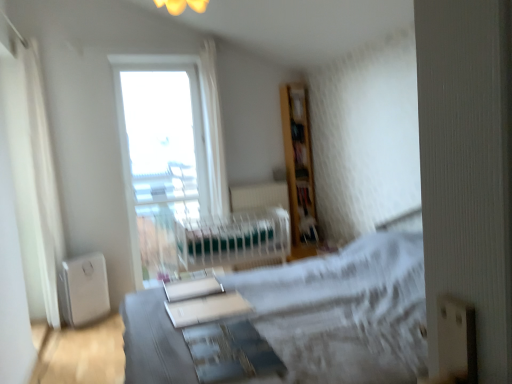
Question: Can you confirm if transparent glass window at upper center is smaller than green fabric hospital bed at center?

Choices:
 (A) no
 (B) yes

Answer: (A)

Question: Considering the relative sizes of transparent glass window at upper center and green fabric hospital bed at center in the image provided, is transparent glass window at upper center thinner than green fabric hospital bed at center?

Choices:
 (A) yes
 (B) no

Answer: (A)

Question: Is transparent glass window at upper center looking in the opposite direction of green fabric hospital bed at center?

Choices:
 (A) no
 (B) yes

Answer: (A)

Question: Is transparent glass window at upper center at the right side of green fabric hospital bed at center?

Choices:
 (A) no
 (B) yes

Answer: (A)

Question: Is the depth of transparent glass window at upper center less than that of green fabric hospital bed at center?

Choices:
 (A) no
 (B) yes

Answer: (A)

Question: Is transparent glass window at upper center behind green fabric hospital bed at center?

Choices:
 (A) no
 (B) yes

Answer: (B)

Question: Is transparent glass window at upper center completely or partially outside of white sheer curtain at left?

Choices:
 (A) no
 (B) yes

Answer: (B)

Question: From a real-world perspective, is transparent glass window at upper center on white sheer curtain at left?

Choices:
 (A) no
 (B) yes

Answer: (A)

Question: From the image's perspective, would you say transparent glass window at upper center is positioned over white sheer curtain at left?

Choices:
 (A) no
 (B) yes

Answer: (B)

Question: Is transparent glass window at upper center oriented away from white sheer curtain at left?

Choices:
 (A) no
 (B) yes

Answer: (A)

Question: Can you confirm if transparent glass window at upper center is thinner than white sheer curtain at left?

Choices:
 (A) yes
 (B) no

Answer: (A)

Question: From a real-world perspective, is transparent glass window at upper center physically below white sheer curtain at left?

Choices:
 (A) yes
 (B) no

Answer: (A)

Question: Does wooden bookshelf at upper right have a lesser height compared to white sheer curtain at left?

Choices:
 (A) no
 (B) yes

Answer: (B)